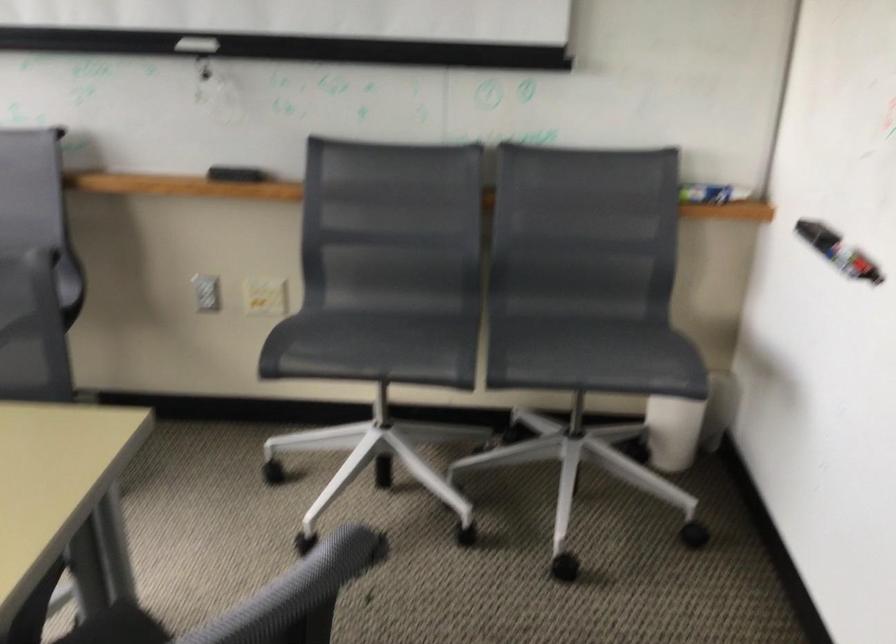
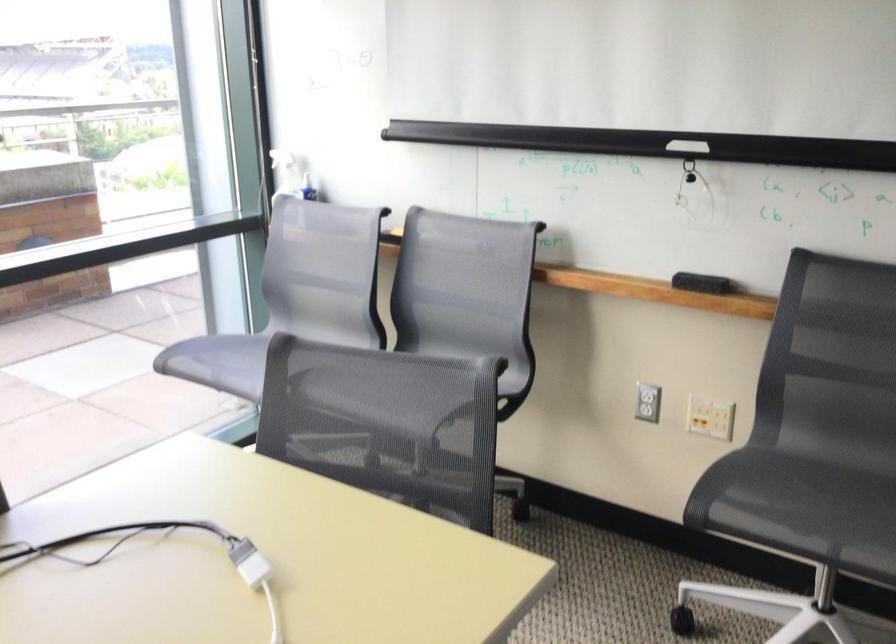
The point at (243, 173) is marked in the first image. Where is the corresponding point in the second image?

(701, 283)